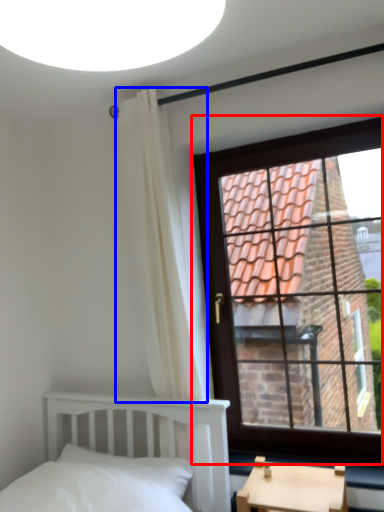
Question: Which point is further to the camera, window (highlighted by a red box) or curtain (highlighted by a blue box)?

Choices:
 (A) window
 (B) curtain

Answer: (A)